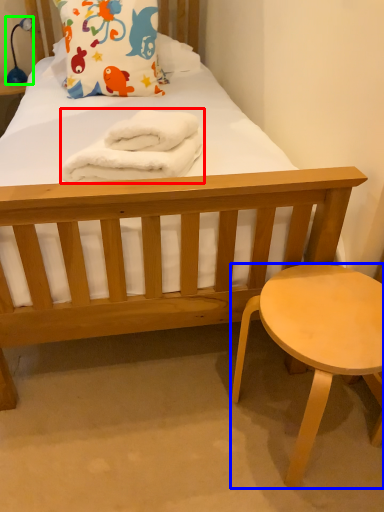
Question: Considering the real-world distances, which object is farthest from material (highlighted by a red box)? stool (highlighted by a blue box) or lamp (highlighted by a green box)?

Choices:
 (A) stool
 (B) lamp

Answer: (B)